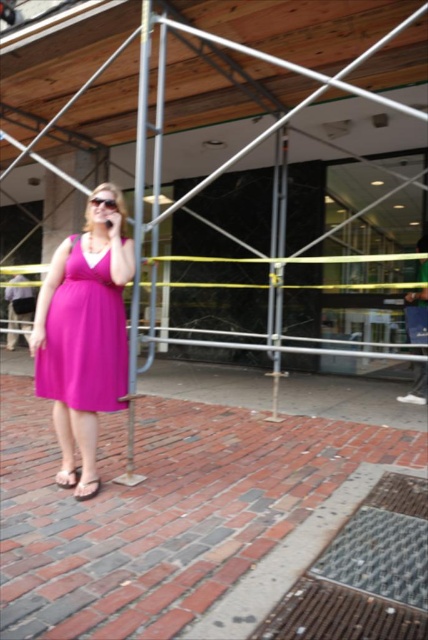
You are a delivery person trying to navigate through the sidewalk. You see the metallic scaffolding at center and the green fabric bag at right. Which object is closer to the left side of the sidewalk?

The metallic scaffolding at center is to the left of the green fabric bag at right, so the metallic scaffolding at center is closer to the left side of the sidewalk.

You are a delivery person with a cart that is 1.5 meters wide. You need to navigate through the scene to reach the sidewalk on the other side of the metallic scaffolding at center. Can your cart fit through the space between the scaffolding and the nearest obstruction?

The metallic scaffolding at center is 3.43 meters from viewer. Since the cart is 1.5 meters wide, it should fit through the space as long as there are no other obstructions closer than 1.5 meters. However, the description only mentions the distance from the viewer to the scaffolding, not the width of the passage. Therefore, it is unclear if the cart can fit without additional information about the available width between the scaffolding and nearby structures.